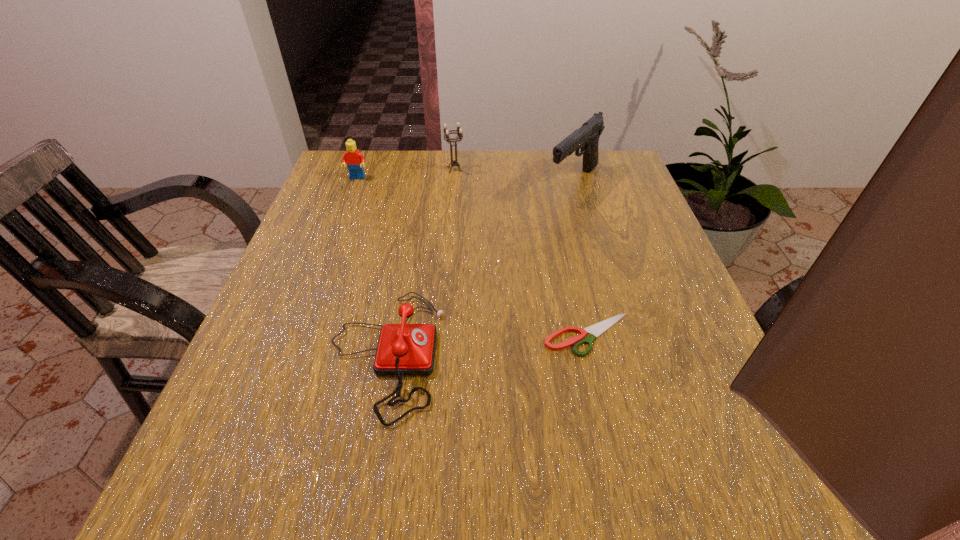
At what (x,y) coordinates should I click in order to perform the action: click on the tallest object. Please return your answer as a coordinate pair (x, y). Looking at the image, I should click on (x=586, y=138).

Image resolution: width=960 pixels, height=540 pixels. I want to click on candle holder, so click(459, 130).

You are a GUI agent. You are given a task and a screenshot of the screen. Output one action in this format:
    pyautogui.click(x=<x>, y=<y>)
    Task: Click on the leftmost object
    The width and height of the screenshot is (960, 540).
    Given the screenshot: What is the action you would take?
    pyautogui.click(x=354, y=159)

Where is `Lego`? Lego is located at coordinates (354, 159).

Where is `the second shortest object`? This screenshot has width=960, height=540. the second shortest object is located at coordinates (403, 349).

Locate an element on the screen. The image size is (960, 540). the shortest object is located at coordinates (597, 329).

The height and width of the screenshot is (540, 960). I want to click on vacant area situated 0.170m at the muzzle of the gun, so click(593, 252).

Find the location of a particular element. The height and width of the screenshot is (540, 960). vacant region located 0.150m on the left of the candle holder is located at coordinates (390, 169).

Where is `vacant space positioned 0.100m on the face of the leftmost object`? vacant space positioned 0.100m on the face of the leftmost object is located at coordinates (348, 203).

At what (x,y) coordinates should I click in order to perform the action: click on free space located on the dial of the second shortest object. Please return your answer as a coordinate pair (x, y). The width and height of the screenshot is (960, 540). Looking at the image, I should click on (587, 354).